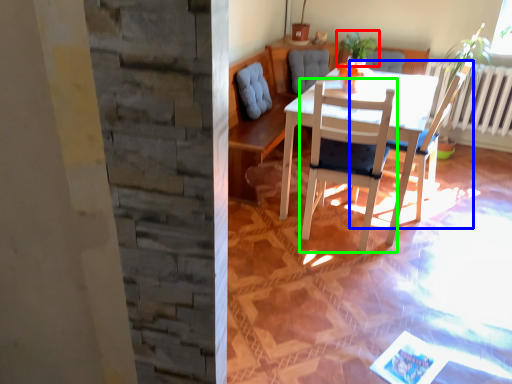
Question: Considering the real-world distances, which object is farthest from houseplant (highlighted by a red box)? chair (highlighted by a blue box) or chair (highlighted by a green box)?

Choices:
 (A) chair
 (B) chair

Answer: (B)